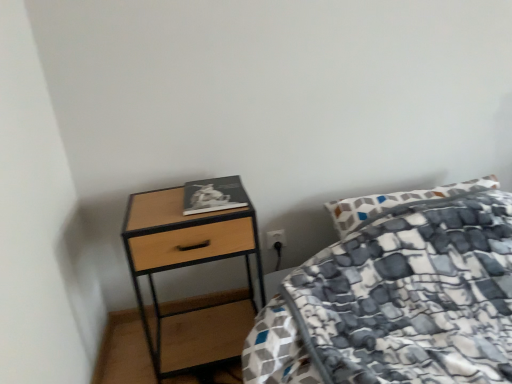
Question: Is woodenmaterial/texturenightstand at left bigger or smaller than matte black book at upper left?

Choices:
 (A) small
 (B) big

Answer: (B)

Question: From a real-world perspective, is woodenmaterial/texturenightstand at left above or below matte black book at upper left?

Choices:
 (A) below
 (B) above

Answer: (A)

Question: Is woodenmaterial/texturenightstand at left situated inside matte black book at upper left or outside?

Choices:
 (A) outside
 (B) inside

Answer: (A)

Question: Considering the positions of matte black book at upper left and woodenmaterial/texturenightstand at left in the image, is matte black book at upper left taller or shorter than woodenmaterial/texturenightstand at left?

Choices:
 (A) tall
 (B) short

Answer: (B)

Question: Considering the positions of matte black book at upper left and woodenmaterial/texturenightstand at left in the image, is matte black book at upper left wider or thinner than woodenmaterial/texturenightstand at left?

Choices:
 (A) wide
 (B) thin

Answer: (B)

Question: Would you say matte black book at upper left is inside or outside woodenmaterial/texturenightstand at left?

Choices:
 (A) outside
 (B) inside

Answer: (A)

Question: Does point (188, 182) appear closer or farther from the camera than point (257, 226)?

Choices:
 (A) farther
 (B) closer

Answer: (B)